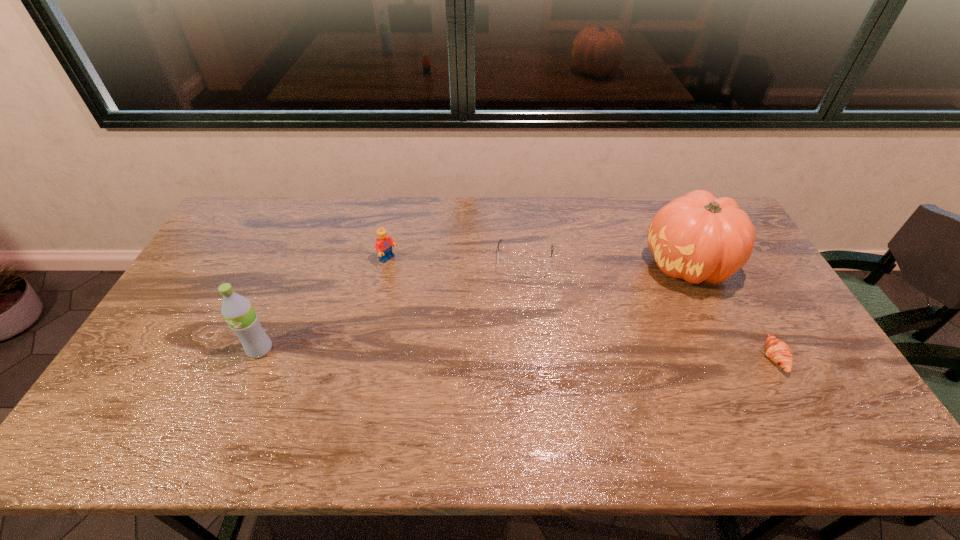
Identify the location of vacant spot on the desktop that is between the water bottle and the pastry and is positioned through the lenses of the fourth tallest object. (511, 353).

Where is `free spot on the desktop that is between the leftmost object and the shortest object and is positioned on the face of the third shortest object`? free spot on the desktop that is between the leftmost object and the shortest object and is positioned on the face of the third shortest object is located at coordinates (530, 353).

Find the location of a particular element. Image resolution: width=960 pixels, height=540 pixels. free space on the desktop that is between the water bottle and the shortest object and is positioned on the carved face of the pumpkin is located at coordinates (552, 354).